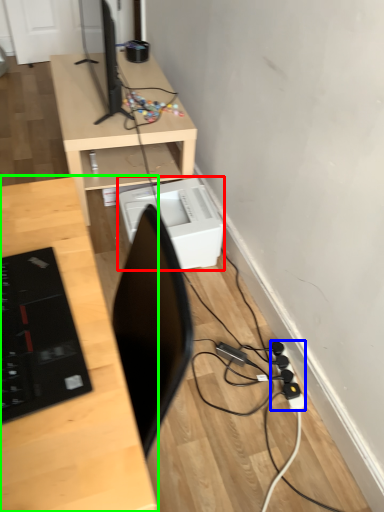
Question: Which is farther away from printer (highlighted by a red box)? extension cord (highlighted by a blue box) or desk (highlighted by a green box)?

Choices:
 (A) extension cord
 (B) desk

Answer: (B)